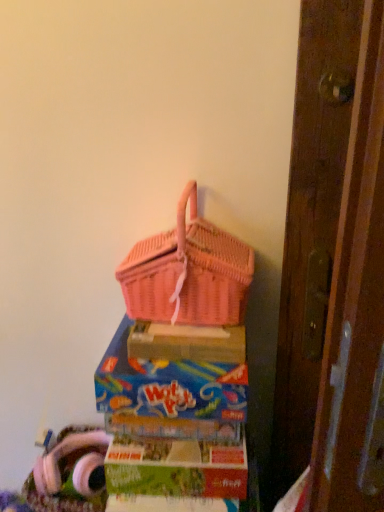
Question: Is matte cardboard box at lower center, which ranks as the 2th box in top-to-bottom order, positioned beyond the bounds of pink wicker basket at upper center, the second box from the bottom?

Choices:
 (A) yes
 (B) no

Answer: (A)

Question: Can you confirm if matte cardboard box at lower center, which ranks as the 1th box in bottom-to-top order, is shorter than pink wicker basket at upper center, placed as the first box when sorted from top to bottom?

Choices:
 (A) no
 (B) yes

Answer: (B)

Question: From the image's perspective, is matte cardboard box at lower center, which ranks as the 2th box in top-to-bottom order, over pink wicker basket at upper center, the second box from the bottom?

Choices:
 (A) yes
 (B) no

Answer: (B)

Question: Is matte cardboard box at lower center, which ranks as the 1th box in bottom-to-top order, to the right of pink wicker basket at upper center, the second box from the bottom, from the viewer's perspective?

Choices:
 (A) yes
 (B) no

Answer: (A)

Question: Can you confirm if matte cardboard box at lower center, which ranks as the 2th box in top-to-bottom order, is positioned to the left of pink wicker basket at upper center, placed as the first box when sorted from top to bottom?

Choices:
 (A) yes
 (B) no

Answer: (B)

Question: Looking at the image, does pink wicker basket at upper center, placed as the first box when sorted from top to bottom, seem bigger or smaller compared to matte cardboard box at lower center, which ranks as the 2th box in top-to-bottom order?

Choices:
 (A) big
 (B) small

Answer: (A)

Question: Considering the positions of point (115, 351) and point (226, 482), is point (115, 351) closer or farther from the camera than point (226, 482)?

Choices:
 (A) farther
 (B) closer

Answer: (A)

Question: From the image's perspective, is pink wicker basket at upper center, placed as the first box when sorted from top to bottom, above or below matte cardboard box at lower center, which ranks as the 1th box in bottom-to-top order?

Choices:
 (A) below
 (B) above

Answer: (B)

Question: Considering their positions, is pink wicker basket at upper center, the second box from the bottom, located in front of or behind matte cardboard box at lower center, which ranks as the 2th box in top-to-bottom order?

Choices:
 (A) front
 (B) behind

Answer: (A)

Question: Would you say pink wicker picnic basket at upper center is inside or outside matte cardboard box at lower center, which ranks as the 1th box in bottom-to-top order?

Choices:
 (A) outside
 (B) inside

Answer: (A)

Question: Is pink wicker picnic basket at upper center taller or shorter than matte cardboard box at lower center, which ranks as the 1th box in bottom-to-top order?

Choices:
 (A) tall
 (B) short

Answer: (A)

Question: Is pink wicker picnic basket at upper center bigger or smaller than matte cardboard box at lower center, which ranks as the 1th box in bottom-to-top order?

Choices:
 (A) small
 (B) big

Answer: (B)

Question: From the image's perspective, is pink wicker picnic basket at upper center positioned above or below matte cardboard box at lower center, which ranks as the 2th box in top-to-bottom order?

Choices:
 (A) below
 (B) above

Answer: (B)

Question: From the image's perspective, is matte cardboard box at lower center, which ranks as the 1th box in bottom-to-top order, above or below pink wicker picnic basket at upper center?

Choices:
 (A) above
 (B) below

Answer: (B)

Question: Would you say matte cardboard box at lower center, which ranks as the 2th box in top-to-bottom order, is to the left or to the right of pink wicker picnic basket at upper center in the picture?

Choices:
 (A) right
 (B) left

Answer: (A)